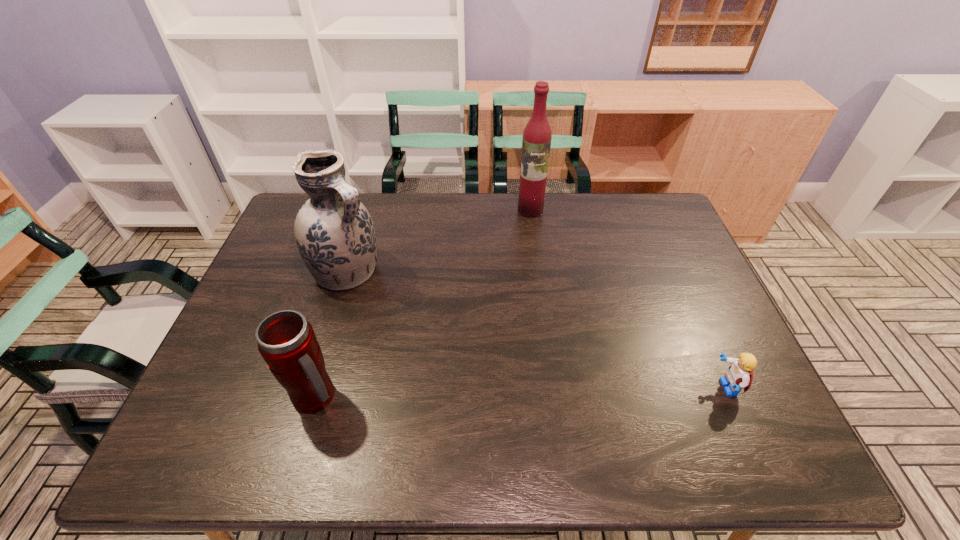
This screenshot has height=540, width=960. What are the coordinates of `the second shortest object` in the screenshot? It's located at (286, 341).

In order to click on the rightmost object in this screenshot , I will do `click(739, 375)`.

Find the location of a particular element. The height and width of the screenshot is (540, 960). the shortest object is located at coordinates (739, 375).

Locate an element on the screen. Image resolution: width=960 pixels, height=540 pixels. liquor is located at coordinates (536, 143).

Find the location of `the farthest object`. the farthest object is located at coordinates (536, 143).

You are a GUI agent. You are given a task and a screenshot of the screen. Output one action in this format:
    pyautogui.click(x=<x>, y=<y>)
    Task: Click on the third shortest object
    The height and width of the screenshot is (540, 960).
    Given the screenshot: What is the action you would take?
    tap(335, 235)

I want to click on the second farthest object, so click(335, 235).

This screenshot has height=540, width=960. In order to click on free space located on the side with the handle of the third tallest object in this screenshot , I will do (496, 397).

At what (x,y) coordinates should I click in order to perform the action: click on free spot located on the front-facing side of the Lego. Please return your answer as a coordinate pair (x, y). This screenshot has height=540, width=960. Looking at the image, I should click on (670, 388).

At what (x,y) coordinates should I click in order to perform the action: click on vacant space located on the front-facing side of the Lego. Please return your answer as a coordinate pair (x, y). Looking at the image, I should click on (611, 388).